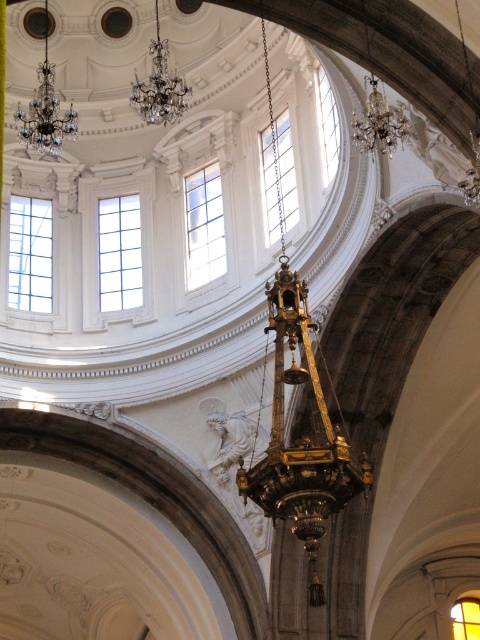
Question: Can you confirm if crystal glass chandelier at upper left is smaller than crystal glass chandelier at upper right?

Choices:
 (A) no
 (B) yes

Answer: (A)

Question: Does crystal glass chandelier at upper center appear on the left side of crystal glass chandelier at upper right?

Choices:
 (A) yes
 (B) no

Answer: (A)

Question: Which of these objects is positioned closest to the crystal glass chandelier at upper left?

Choices:
 (A) crystal glass chandelier at upper right
 (B) crystal glass chandelier at upper center

Answer: (B)

Question: Which is nearer to the crystal glass chandelier at upper left?

Choices:
 (A) crystal glass chandelier at upper right
 (B) crystal glass chandelier at upper center

Answer: (B)

Question: Can you confirm if crystal glass chandelier at upper center is positioned above crystal glass chandelier at upper right?

Choices:
 (A) yes
 (B) no

Answer: (A)

Question: Which object is farther from the camera taking this photo?

Choices:
 (A) crystal glass chandelier at upper center
 (B) crystal glass chandelier at upper left
 (C) crystal glass chandelier at upper right

Answer: (A)